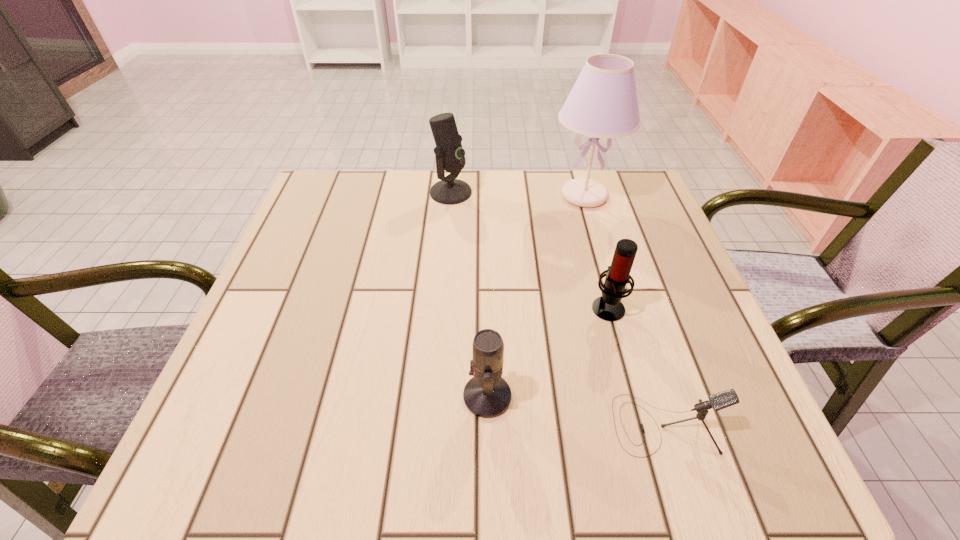
Where is `the tallest object`? The image size is (960, 540). the tallest object is located at coordinates (603, 103).

At what (x,y) coordinates should I click in order to perform the action: click on the farthest microphone. Please return your answer as a coordinate pair (x, y). Looking at the image, I should click on (450, 156).

Locate an element on the screen. Image resolution: width=960 pixels, height=540 pixels. the tallest microphone is located at coordinates (450, 156).

Identify the location of the second farthest microphone. (608, 307).

Find the location of a particular element. the shortest object is located at coordinates (721, 400).

The width and height of the screenshot is (960, 540). In order to click on vacant space located 0.060m on the front of the tallest object in this screenshot , I will do `click(595, 233)`.

Where is `blank area located on the right of the farthest microphone`? blank area located on the right of the farthest microphone is located at coordinates (540, 192).

Where is `free space located on the back of the third nearest object`? free space located on the back of the third nearest object is located at coordinates (587, 228).

The image size is (960, 540). In order to click on free location located 0.310m on the stand of the shortest microphone in this screenshot , I will do `click(421, 424)`.

Where is `free space located 0.050m on the stand of the shortest microphone`? free space located 0.050m on the stand of the shortest microphone is located at coordinates (583, 424).